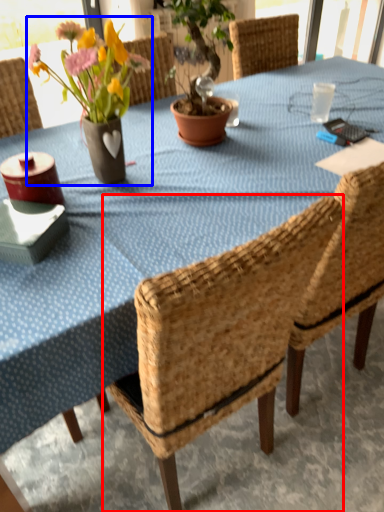
Question: Which object is further to the camera taking this photo, chair (highlighted by a red box) or floral arrangement (highlighted by a blue box)?

Choices:
 (A) chair
 (B) floral arrangement

Answer: (B)